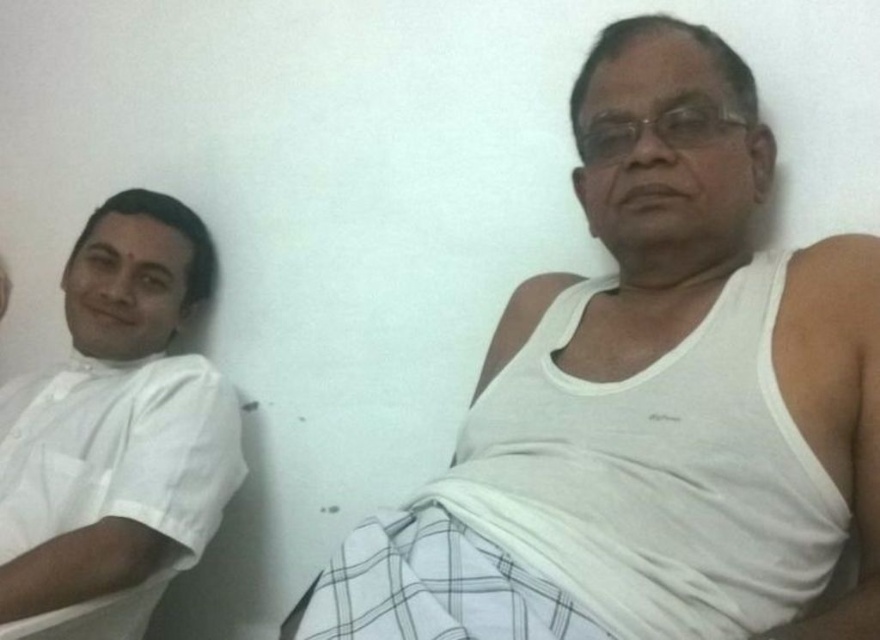
Question: Does white cotton tank top at center appear under white cotton shirt at left?

Choices:
 (A) yes
 (B) no

Answer: (B)

Question: Among these objects, which one is nearest to the camera?

Choices:
 (A) white cotton shirt at left
 (B) white cotton tank top at center

Answer: (B)

Question: Does white cotton tank top at center have a lesser width compared to white cotton shirt at left?

Choices:
 (A) yes
 (B) no

Answer: (B)

Question: Which point is closer to the camera taking this photo?

Choices:
 (A) (208, 477)
 (B) (786, 352)

Answer: (B)

Question: Which point is farther to the camera?

Choices:
 (A) white cotton tank top at center
 (B) white cotton shirt at left

Answer: (B)

Question: Is white cotton tank top at center to the right of white cotton shirt at left from the viewer's perspective?

Choices:
 (A) yes
 (B) no

Answer: (A)